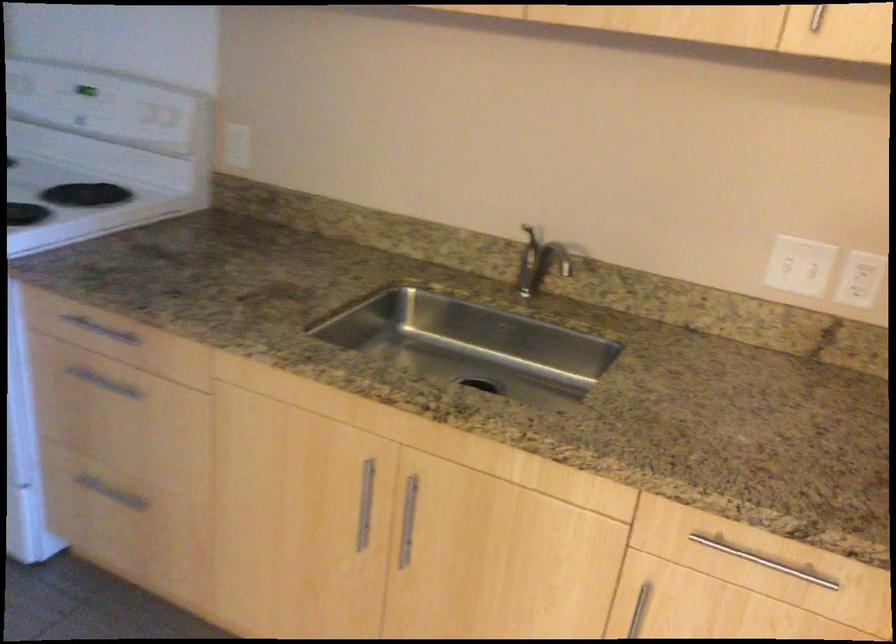
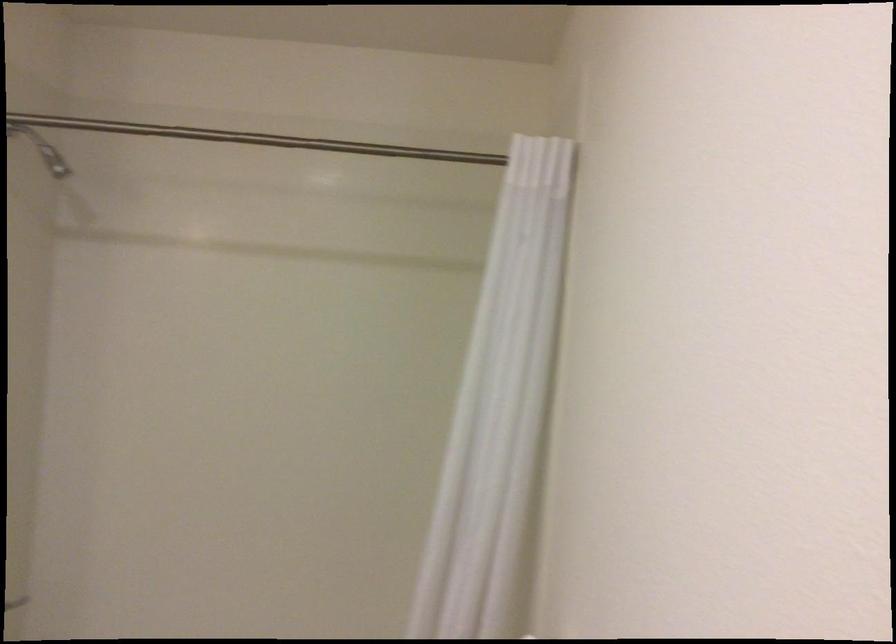
Question: The images are taken continuously from a first-person perspective. In which direction is your viewpoint rotating?

Choices:
 (A) Left
 (B) Right
 (C) Up
 (D) Down

Answer: (A)